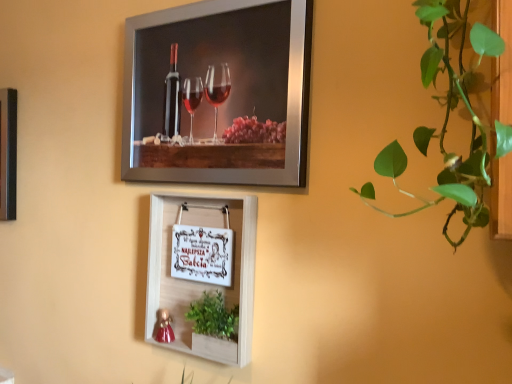
What do you see at coordinates (219, 93) in the screenshot?
I see `metallic silver picture frame at upper center, marked as the first picture frame in a top-to-bottom arrangement` at bounding box center [219, 93].

Describe the element at coordinates (213, 316) in the screenshot. I see `green leafy plant at lower center` at that location.

This screenshot has height=384, width=512. What are the coordinates of `white wood picture frame at center, acting as the 1th picture frame starting from the bottom` in the screenshot? It's located at (199, 282).

Where is `metallic silver picture frame at upper center, marked as the first picture frame in a top-to-bottom arrangement`? The image size is (512, 384). metallic silver picture frame at upper center, marked as the first picture frame in a top-to-bottom arrangement is located at coordinates (219, 93).

Which object is positioned more to the right, green leafy plant at right or green leafy plant at lower center?

green leafy plant at right.

From a real-world perspective, is green leafy plant at right physically below green leafy plant at lower center?

No, from a real-world perspective, green leafy plant at right is not under green leafy plant at lower center.

How much distance is there between green leafy plant at right and green leafy plant at lower center?

A distance of 24.32 inches exists between green leafy plant at right and green leafy plant at lower center.

Looking at this image, considering the sizes of objects green leafy plant at right and green leafy plant at lower center in the image provided, who is smaller, green leafy plant at right or green leafy plant at lower center?

green leafy plant at lower center is smaller.

At what (x,y) coordinates should I click in order to perform the action: click on picture frame behind the green leafy plant at lower center. Please return your answer as a coordinate pair (x, y). This screenshot has width=512, height=384. Looking at the image, I should click on (199, 282).

Is white wood picture frame at center, the 2th picture frame positioned from the top, taller than green leafy plant at lower center?

Indeed, white wood picture frame at center, the 2th picture frame positioned from the top, has a greater height compared to green leafy plant at lower center.

Are white wood picture frame at center, acting as the 1th picture frame starting from the bottom, and green leafy plant at lower center far apart?

They are positioned close to each other.

From the image's perspective, is white wood picture frame at center, the 2th picture frame positioned from the top, below green leafy plant at lower center?

No, from the image's perspective, white wood picture frame at center, the 2th picture frame positioned from the top, is not beneath green leafy plant at lower center.

Is white wood picture frame at center, the 2th picture frame positioned from the top, next to metallic silver picture frame at upper center, marked as the first picture frame in a top-to-bottom arrangement, and touching it?

white wood picture frame at center, the 2th picture frame positioned from the top, and metallic silver picture frame at upper center, marked as the first picture frame in a top-to-bottom arrangement, are clearly separated.

Between white wood picture frame at center, the 2th picture frame positioned from the top, and metallic silver picture frame at upper center, marked as the first picture frame in a top-to-bottom arrangement, which one has smaller size?

With smaller size is white wood picture frame at center, the 2th picture frame positioned from the top.

Could you tell me if white wood picture frame at center, acting as the 1th picture frame starting from the bottom, is facing metallic silver picture frame at upper center, marked as the first picture frame in a top-to-bottom arrangement?

No, white wood picture frame at center, acting as the 1th picture frame starting from the bottom, does not turn towards metallic silver picture frame at upper center, marked as the first picture frame in a top-to-bottom arrangement.

Is white wood picture frame at center, acting as the 1th picture frame starting from the bottom, inside or outside of metallic silver picture frame at upper center, positioned as the second picture frame in bottom-to-top order?

white wood picture frame at center, acting as the 1th picture frame starting from the bottom, is outside metallic silver picture frame at upper center, positioned as the second picture frame in bottom-to-top order.

Which object is thinner, metallic silver picture frame at upper center, positioned as the second picture frame in bottom-to-top order, or green leafy plant at lower center?

With smaller width is metallic silver picture frame at upper center, positioned as the second picture frame in bottom-to-top order.

At what (x,y) coordinates should I click in order to perform the action: click on plant that is on the right side of metallic silver picture frame at upper center, positioned as the second picture frame in bottom-to-top order. Please return your answer as a coordinate pair (x, y). Looking at the image, I should click on (213, 316).

From the image's perspective, is metallic silver picture frame at upper center, marked as the first picture frame in a top-to-bottom arrangement, above or below green leafy plant at lower center?

Clearly, from the image's perspective, metallic silver picture frame at upper center, marked as the first picture frame in a top-to-bottom arrangement, is above green leafy plant at lower center.

From a real-world perspective, is metallic silver picture frame at upper center, marked as the first picture frame in a top-to-bottom arrangement, physically below green leafy plant at lower center?

No, from a real-world perspective, metallic silver picture frame at upper center, marked as the first picture frame in a top-to-bottom arrangement, is not under green leafy plant at lower center.

Is metallic silver picture frame at upper center, positioned as the second picture frame in bottom-to-top order, to the left of green leafy plant at right from the viewer's perspective?

Yes, metallic silver picture frame at upper center, positioned as the second picture frame in bottom-to-top order, is to the left of green leafy plant at right.

From the picture: Is metallic silver picture frame at upper center, positioned as the second picture frame in bottom-to-top order, outside of green leafy plant at right?

Yes, metallic silver picture frame at upper center, positioned as the second picture frame in bottom-to-top order, is outside of green leafy plant at right.

How much distance is there between metallic silver picture frame at upper center, positioned as the second picture frame in bottom-to-top order, and green leafy plant at right?

metallic silver picture frame at upper center, positioned as the second picture frame in bottom-to-top order, is 40.69 centimeters away from green leafy plant at right.

Who is shorter, metallic silver picture frame at upper center, positioned as the second picture frame in bottom-to-top order, or green leafy plant at right?

green leafy plant at right.

Which is in front, green leafy plant at lower center or green leafy plant at right?

green leafy plant at right.

In terms of size, does green leafy plant at lower center appear bigger or smaller than green leafy plant at right?

Considering their sizes, green leafy plant at lower center takes up less space than green leafy plant at right.

Consider the image. Considering the relative sizes of green leafy plant at lower center and green leafy plant at right in the image provided, is green leafy plant at lower center shorter than green leafy plant at right?

Yes.

In the scene shown: Is green leafy plant at lower center not near green leafy plant at right?

green leafy plant at lower center is near green leafy plant at right, not far away.

Between white wood picture frame at center, acting as the 1th picture frame starting from the bottom, and green leafy plant at right, which one is positioned in front?

Positioned in front is green leafy plant at right.

Is white wood picture frame at center, the 2th picture frame positioned from the top, far from green leafy plant at right?

No.

Considering the relative sizes of white wood picture frame at center, acting as the 1th picture frame starting from the bottom, and green leafy plant at right in the image provided, is white wood picture frame at center, acting as the 1th picture frame starting from the bottom, bigger than green leafy plant at right?

Actually, white wood picture frame at center, acting as the 1th picture frame starting from the bottom, might be smaller than green leafy plant at right.

In the image, is white wood picture frame at center, acting as the 1th picture frame starting from the bottom, on the left side or the right side of green leafy plant at right?

Based on their positions, white wood picture frame at center, acting as the 1th picture frame starting from the bottom, is located to the left of green leafy plant at right.

Where is `plant below the green leafy plant at right (from the image's perspective)`? This screenshot has width=512, height=384. plant below the green leafy plant at right (from the image's perspective) is located at coordinates (213, 316).

The width and height of the screenshot is (512, 384). There is a green leafy plant at lower center. What are the coordinates of `the 1st picture frame above it (from the image's perspective)` in the screenshot? It's located at 199,282.

From the image, which object appears to be farther from green leafy plant at lower center, white wood picture frame at center, acting as the 1th picture frame starting from the bottom, or metallic silver picture frame at upper center, positioned as the second picture frame in bottom-to-top order?

metallic silver picture frame at upper center, positioned as the second picture frame in bottom-to-top order, is positioned further to the anchor green leafy plant at lower center.

Consider the image. Estimate the real-world distances between objects in this image. Which object is closer to metallic silver picture frame at upper center, marked as the first picture frame in a top-to-bottom arrangement, green leafy plant at right or white wood picture frame at center, the 2th picture frame positioned from the top?

Based on the image, white wood picture frame at center, the 2th picture frame positioned from the top, appears to be nearer to metallic silver picture frame at upper center, marked as the first picture frame in a top-to-bottom arrangement.

Looking at the image, which one is located closer to white wood picture frame at center, acting as the 1th picture frame starting from the bottom, green leafy plant at right or green leafy plant at lower center?

green leafy plant at lower center lies closer to white wood picture frame at center, acting as the 1th picture frame starting from the bottom, than the other object.

Estimate the real-world distances between objects in this image. Which object is closer to white wood picture frame at center, acting as the 1th picture frame starting from the bottom, green leafy plant at lower center or metallic silver picture frame at upper center, positioned as the second picture frame in bottom-to-top order?

green leafy plant at lower center is closer to white wood picture frame at center, acting as the 1th picture frame starting from the bottom.

Looking at the image, which one is located further to white wood picture frame at center, acting as the 1th picture frame starting from the bottom, metallic silver picture frame at upper center, positioned as the second picture frame in bottom-to-top order, or green leafy plant at right?

green leafy plant at right is positioned further to the anchor white wood picture frame at center, acting as the 1th picture frame starting from the bottom.

In the scene shown: When comparing their distances from green leafy plant at right, does white wood picture frame at center, acting as the 1th picture frame starting from the bottom, or green leafy plant at lower center seem closer?

Based on the image, white wood picture frame at center, acting as the 1th picture frame starting from the bottom, appears to be nearer to green leafy plant at right.

Which object lies further to the anchor point green leafy plant at lower center, white wood picture frame at center, the 2th picture frame positioned from the top, or green leafy plant at right?

Among the two, green leafy plant at right is located further to green leafy plant at lower center.

Estimate the real-world distances between objects in this image. Which object is closer to green leafy plant at right, green leafy plant at lower center or white wood picture frame at center, acting as the 1th picture frame starting from the bottom?

white wood picture frame at center, acting as the 1th picture frame starting from the bottom.

Identify the location of picture frame between green leafy plant at right and white wood picture frame at center, acting as the 1th picture frame starting from the bottom, in the front-back direction. (219, 93).

This screenshot has width=512, height=384. What are the coordinates of `plant between green leafy plant at right and white wood picture frame at center, acting as the 1th picture frame starting from the bottom, from front to back` in the screenshot? It's located at (213, 316).

Image resolution: width=512 pixels, height=384 pixels. In order to click on houseplant between metallic silver picture frame at upper center, marked as the first picture frame in a top-to-bottom arrangement, and green leafy plant at lower center vertically in this screenshot , I will do `click(452, 110)`.

This screenshot has width=512, height=384. I want to click on picture frame between metallic silver picture frame at upper center, marked as the first picture frame in a top-to-bottom arrangement, and green leafy plant at lower center in the up-down direction, so (199, 282).